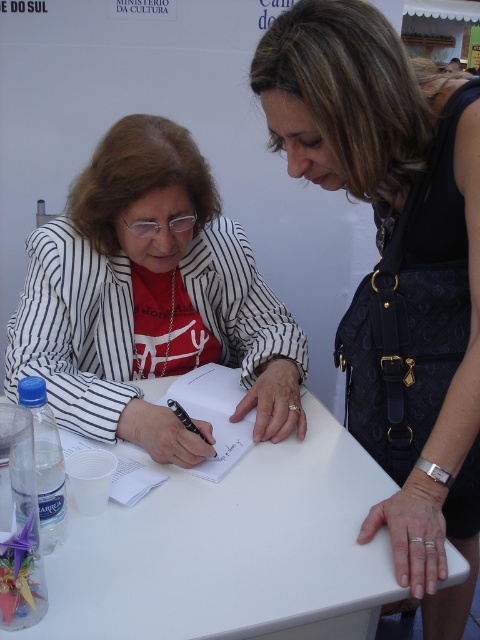
Question: Can you confirm if black leather handbag at upper right is positioned below white plastic table at center?

Choices:
 (A) yes
 (B) no

Answer: (B)

Question: Which object appears farthest from the camera in this image?

Choices:
 (A) black ink pen at center
 (B) white plastic table at center
 (C) matte black jacket at center
 (D) black leather handbag at upper right

Answer: (A)

Question: Which is farther from the matte black jacket at center?

Choices:
 (A) black ink pen at center
 (B) black leather handbag at upper right
 (C) white plastic table at center

Answer: (A)

Question: Is black leather handbag at upper right below white plastic table at center?

Choices:
 (A) yes
 (B) no

Answer: (B)

Question: Can you confirm if white plastic table at center is wider than black ink pen at center?

Choices:
 (A) no
 (B) yes

Answer: (B)

Question: Estimate the real-world distances between objects in this image. Which object is closer to the black ink pen at center?

Choices:
 (A) black leather handbag at upper right
 (B) white plastic table at center
 (C) matte black jacket at center

Answer: (B)